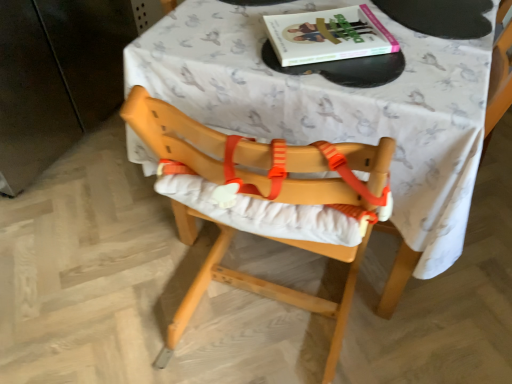
What do you see at coordinates (264, 197) in the screenshot? I see `natural wood highchair at center` at bounding box center [264, 197].

The image size is (512, 384). What are the coordinates of `hardcover book at upper center` in the screenshot? It's located at (328, 35).

The image size is (512, 384). I want to click on natural wood highchair at center, so click(x=264, y=197).

From the image's perspective, is hardcover book at upper center positioned above or below white fabric-covered table at center?

hardcover book at upper center is above white fabric-covered table at center.

Is hardcover book at upper center completely or partially outside of white fabric-covered table at center?

Actually, hardcover book at upper center is at least partially inside white fabric-covered table at center.

Is hardcover book at upper center looking in the opposite direction of white fabric-covered table at center?

Yes, white fabric-covered table at center is at the back of hardcover book at upper center.

Is white fabric-covered table at center taller or shorter than natural wood highchair at center?

In the image, white fabric-covered table at center appears to be shorter than natural wood highchair at center.

Does white fabric-covered table at center turn towards natural wood highchair at center?

Yes.

From a real-world perspective, who is located higher, white fabric-covered table at center or natural wood highchair at center?

From a 3D spatial view, natural wood highchair at center is above.

Does hardcover book at upper center come behind natural wood highchair at center?

Yes, it is behind natural wood highchair at center.

Based on the photo, is hardcover book at upper center turned away from natural wood highchair at center?

Yes, hardcover book at upper center is positioned with its back facing natural wood highchair at center.

Is point (338, 35) in front of point (344, 291)?

Yes.

How many degrees apart are the facing directions of hardcover book at upper center and natural wood highchair at center?

hardcover book at upper center and natural wood highchair at center are facing 146 degrees away from each other.

Is point (195, 128) closer to camera compared to point (290, 45)?

Yes, point (195, 128) is in front of point (290, 45).

Which is more to the right, natural wood highchair at center or hardcover book at upper center?

From the viewer's perspective, hardcover book at upper center appears more on the right side.

Locate an element on the screen. chair in front of the hardcover book at upper center is located at coordinates (264, 197).

Does natural wood highchair at center turn towards hardcover book at upper center?

Yes.

From the image's perspective, is white fabric-covered table at center positioned above or below hardcover book at upper center?

Clearly, from the image's perspective, white fabric-covered table at center is below hardcover book at upper center.

Considering the sizes of white fabric-covered table at center and hardcover book at upper center in the image, is white fabric-covered table at center wider or thinner than hardcover book at upper center?

In the image, white fabric-covered table at center appears to be wider than hardcover book at upper center.

Is hardcover book at upper center at the back of white fabric-covered table at center?

No, white fabric-covered table at center's orientation is not away from hardcover book at upper center.

Which object is more forward, white fabric-covered table at center or hardcover book at upper center?

white fabric-covered table at center is closer to the camera.

Does point (229, 280) come closer to viewer compared to point (469, 107)?

That is False.

Is natural wood highchair at center smaller than white fabric-covered table at center?

Yes, natural wood highchair at center is smaller than white fabric-covered table at center.

In the scene shown: How different are the orientations of natural wood highchair at center and white fabric-covered table at center in degrees?

The angular difference between natural wood highchair at center and white fabric-covered table at center is 180 degrees.

Considering the relative positions of natural wood highchair at center and white fabric-covered table at center in the image provided, is natural wood highchair at center to the left of white fabric-covered table at center from the viewer's perspective?

Yes.

Where is `table that appears below the hardcover book at upper center (from the image's perspective)`? table that appears below the hardcover book at upper center (from the image's perspective) is located at coordinates (334, 106).

I want to click on chair located on the left of white fabric-covered table at center, so click(264, 197).

When comparing their distances from natural wood highchair at center, does hardcover book at upper center or white fabric-covered table at center seem closer?

Based on the image, white fabric-covered table at center appears to be nearer to natural wood highchair at center.

Which object lies nearer to the anchor point natural wood highchair at center, white fabric-covered table at center or hardcover book at upper center?

white fabric-covered table at center is closer to natural wood highchair at center.

Looking at this image, based on their spatial positions, is white fabric-covered table at center or natural wood highchair at center further from hardcover book at upper center?

natural wood highchair at center.

Based on the photo, when comparing their distances from white fabric-covered table at center, does hardcover book at upper center or natural wood highchair at center seem closer?

The object closer to white fabric-covered table at center is hardcover book at upper center.

When comparing their distances from white fabric-covered table at center, does natural wood highchair at center or hardcover book at upper center seem further?

natural wood highchair at center is positioned further to the anchor white fabric-covered table at center.

From the image, which object appears to be nearer to hardcover book at upper center, natural wood highchair at center or white fabric-covered table at center?

white fabric-covered table at center lies closer to hardcover book at upper center than the other object.

Identify the location of table that lies between hardcover book at upper center and natural wood highchair at center from top to bottom. This screenshot has height=384, width=512. (334, 106).